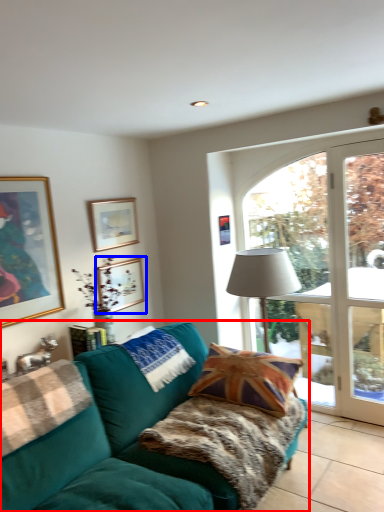
Question: Which of the following is the closest to the observer, studio couch (highlighted by a red box) or picture frame (highlighted by a blue box)?

Choices:
 (A) studio couch
 (B) picture frame

Answer: (A)